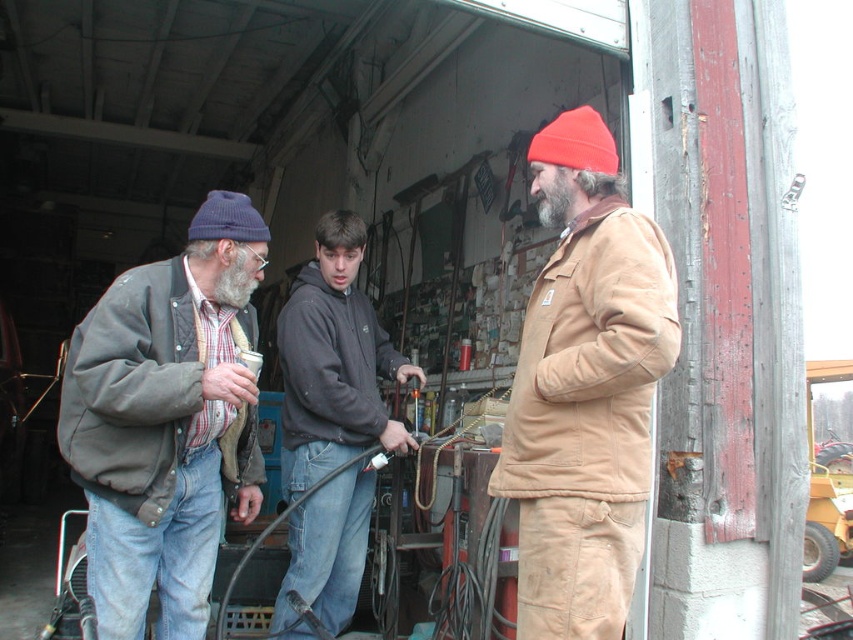
You are a tailor trying to fit a customer for a hat. The customer has a head circumference of 55 cm. You have two options in the image, the orange knit beanie at center and the knitted woolen beanie at left. Which beanie would you recommend based on their sizes?

The orange knit beanie at center has a smaller width than the knitted woolen beanie at left. Since the customer has a head circumference of 55 cm, the knitted woolen beanie at left is more likely to fit comfortably as it is wider.

You are standing in the workshop and want to reach a point that is 6.91 feet away from you. Can you confirm if the point at coordinates point (585, 118) is exactly that distance?

The point (585, 118) is exactly 6.91 feet away from the viewer, so yes, it is the correct distance.